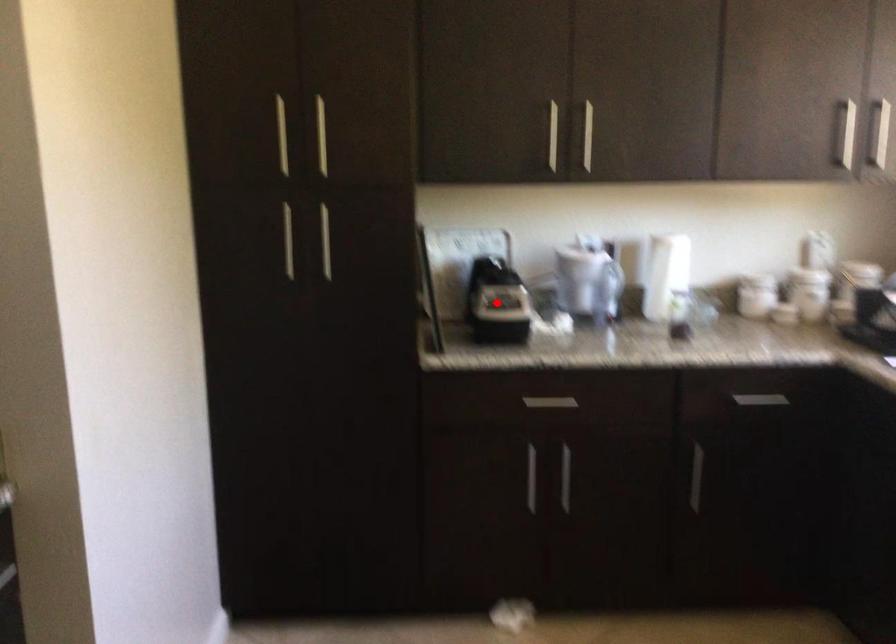
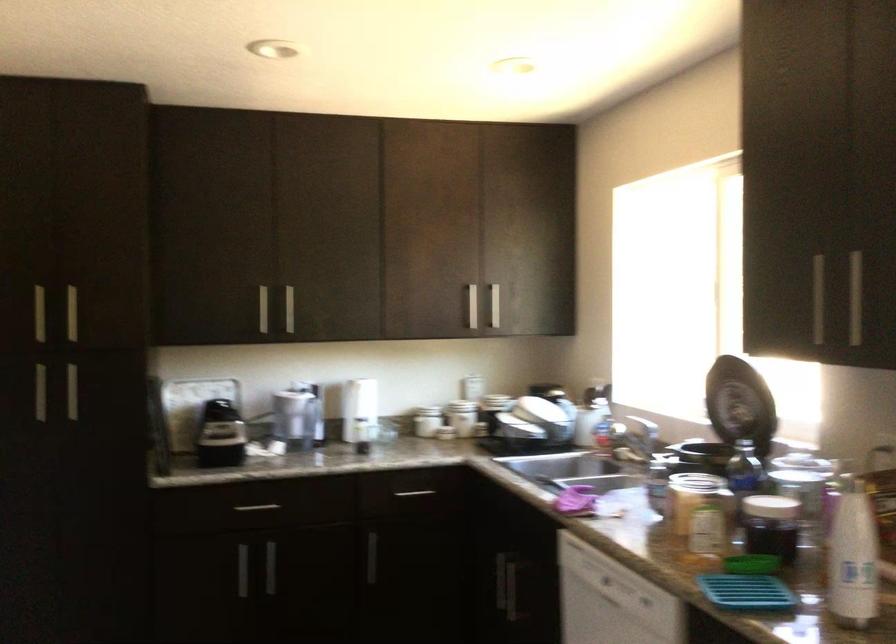
Question: I am providing you with two images of the same scene from different viewpoints. Image1 has a red point marked. In image2, the corresponding 3D location appears at what relative position? Reply with the corresponding letter.

Choices:
 (A) Closer
 (B) Farther

Answer: (B)